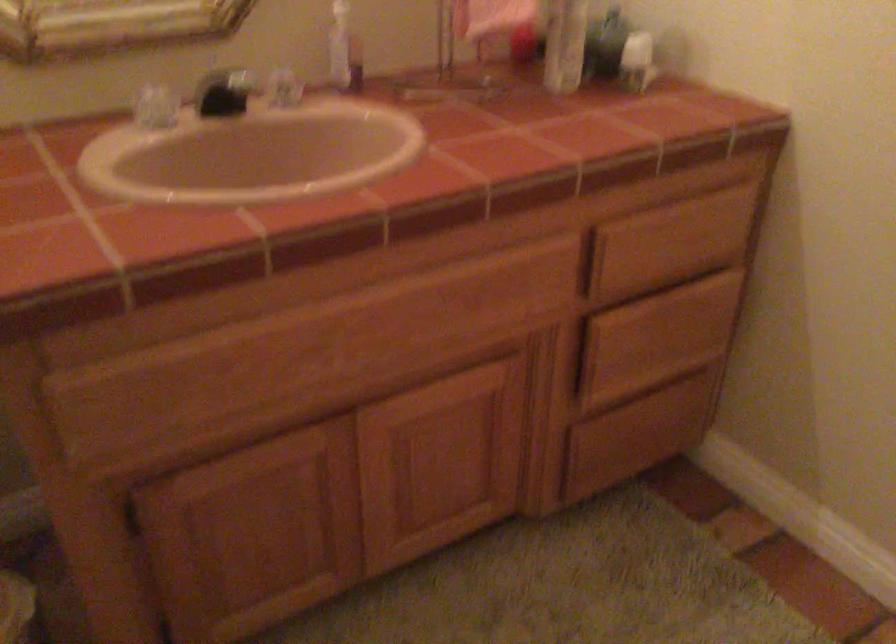
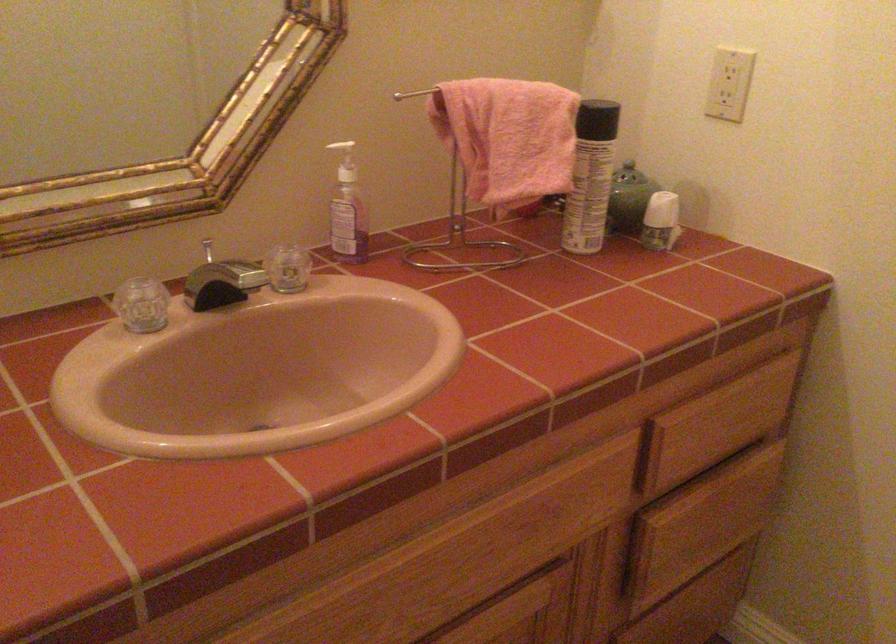
Locate, in the second image, the point that corresponds to (x=220, y=73) in the first image.

(208, 250)